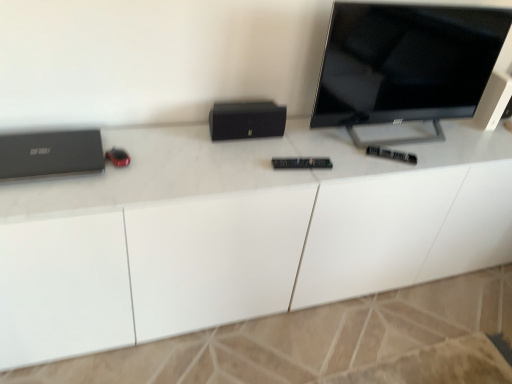
The image size is (512, 384). In order to click on vacant space to the right of black plastic remote at center in this screenshot , I will do `click(432, 167)`.